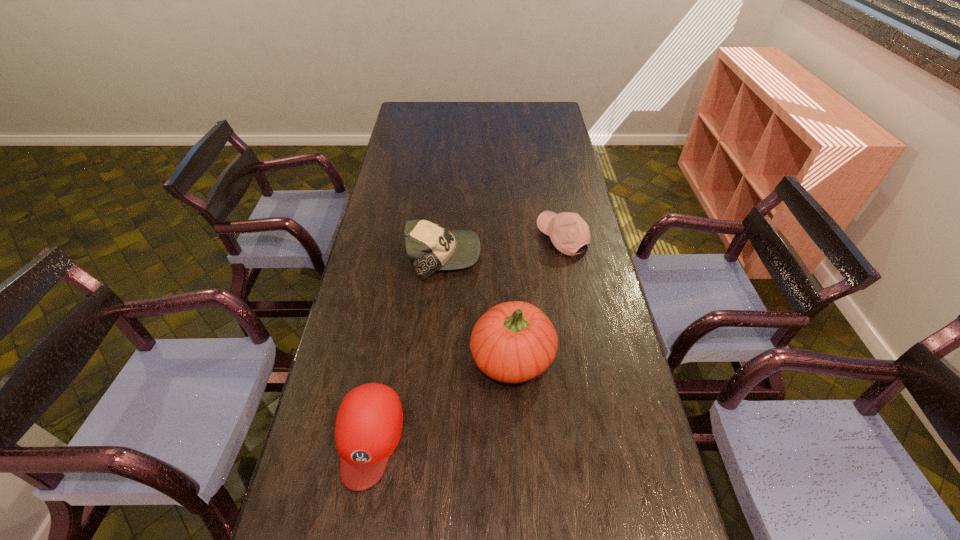
Identify the location of the tallest object. Image resolution: width=960 pixels, height=540 pixels. (513, 342).

Identify the location of the rightmost baseball cap. This screenshot has width=960, height=540. (568, 232).

This screenshot has height=540, width=960. I want to click on the nearest baseball cap, so click(x=369, y=422).

I want to click on free space located 0.350m on the back of the pumpkin, so click(506, 245).

Find the location of a particular element. This screenshot has width=960, height=540. vacant space located on the front-facing side of the rightmost baseball cap is located at coordinates (484, 238).

The height and width of the screenshot is (540, 960). In order to click on free space located 0.170m on the front-facing side of the rightmost baseball cap in this screenshot , I will do `click(490, 238)`.

Where is `free space located 0.300m on the front-facing side of the rightmost baseball cap`? The width and height of the screenshot is (960, 540). free space located 0.300m on the front-facing side of the rightmost baseball cap is located at coordinates (453, 238).

Image resolution: width=960 pixels, height=540 pixels. Find the location of `free space located 0.060m on the front-facing side of the nearest baseball cap`. free space located 0.060m on the front-facing side of the nearest baseball cap is located at coordinates (353, 523).

Identify the location of object that is at the right edge. (568, 232).

The height and width of the screenshot is (540, 960). I want to click on vacant space at the far edge of the desktop, so click(x=508, y=104).